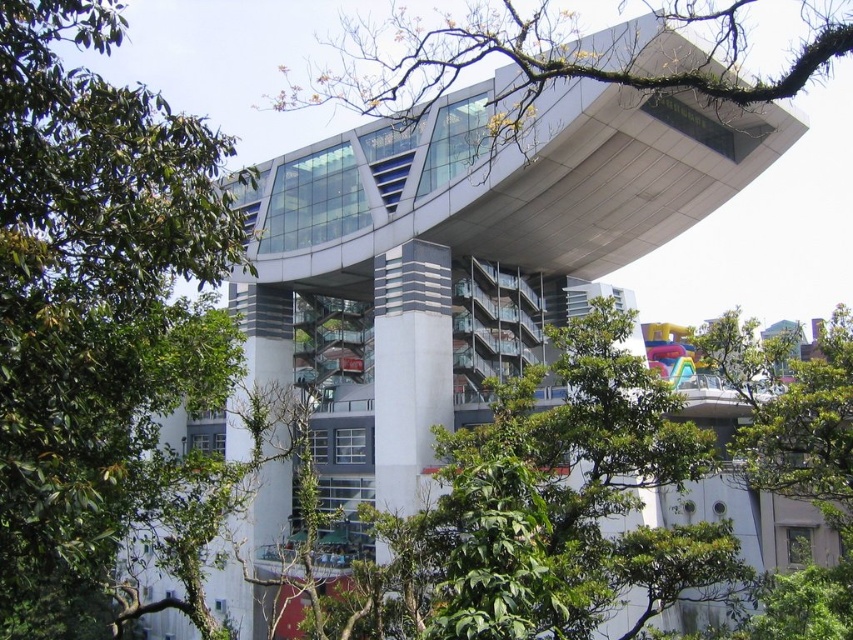
Can you confirm if green leafy tree at upper left is smaller than green leafy branch at upper center?

Correct, green leafy tree at upper left occupies less space than green leafy branch at upper center.

Does point (103, 6) come in front of point (738, 60)?

Yes, point (103, 6) is in front of point (738, 60).

What are the coordinates of `green leafy tree at upper left` in the screenshot? It's located at (91, 304).